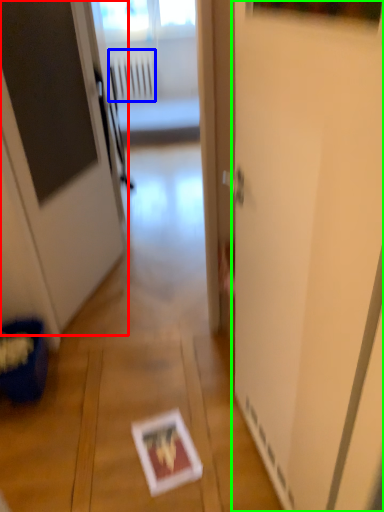
Question: Estimate the real-world distances between objects in this image. Which object is farther from door (highlighted by a red box), radiator (highlighted by a blue box) or screen door (highlighted by a green box)?

Choices:
 (A) radiator
 (B) screen door

Answer: (A)